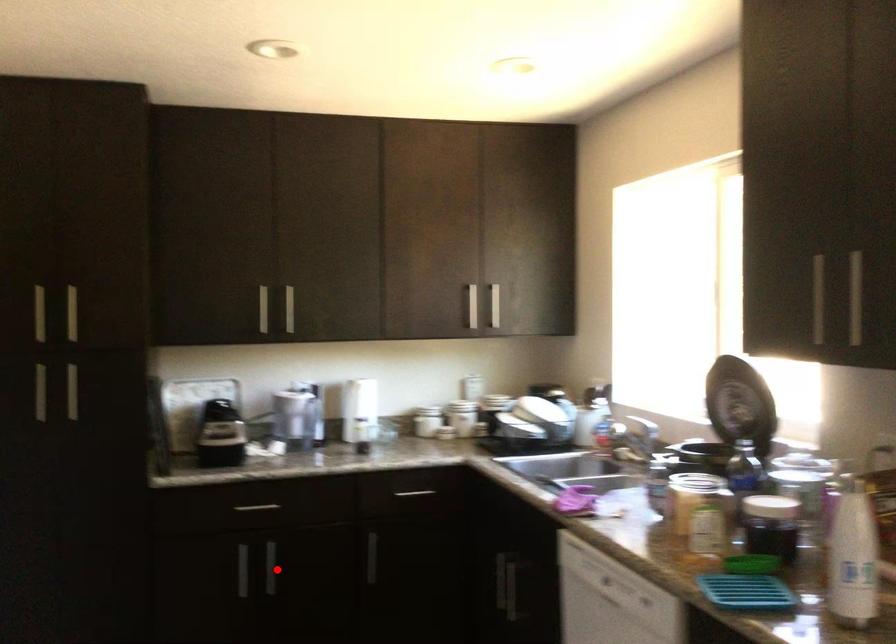
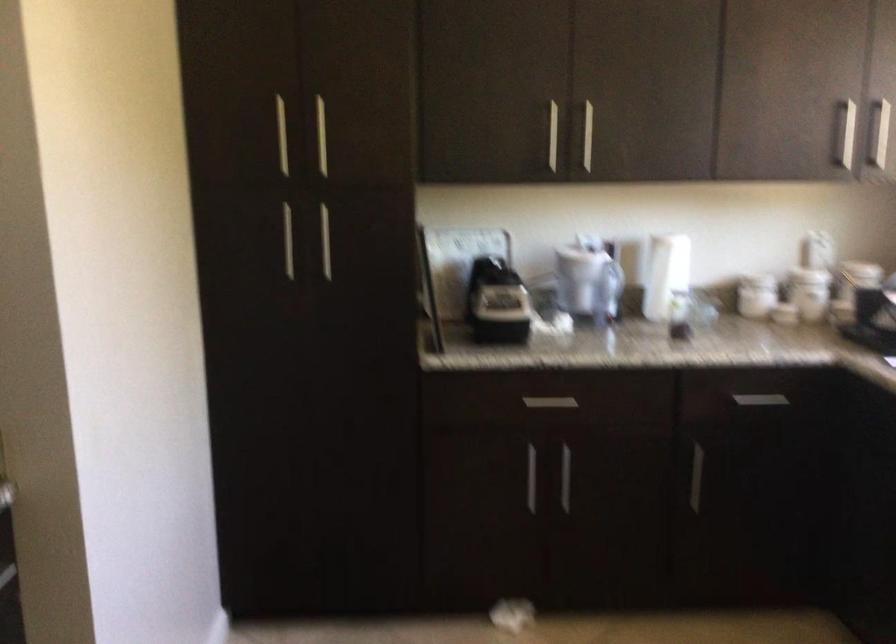
Find the pixel in the second image that matches the highlighted location in the first image.

(565, 478)